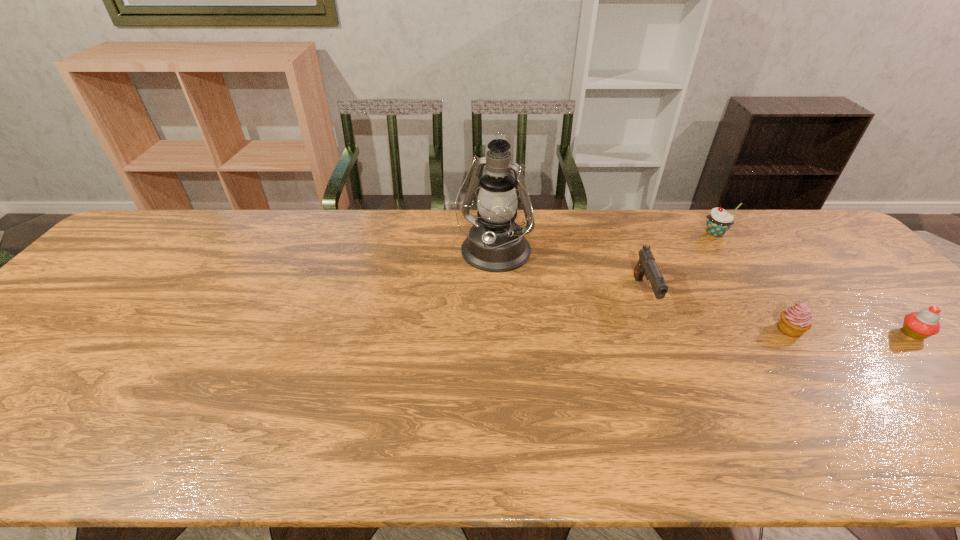
This screenshot has width=960, height=540. I want to click on cupcake at the far edge, so click(x=719, y=221).

At what (x,y) coordinates should I click in order to perform the action: click on object located at the right edge. Please return your answer as a coordinate pair (x, y). Looking at the image, I should click on (920, 325).

The height and width of the screenshot is (540, 960). What are the coordinates of `vacant point at the far edge` in the screenshot? It's located at (584, 221).

This screenshot has height=540, width=960. What are the coordinates of `vacant space at the near edge of the desktop` in the screenshot? It's located at (445, 446).

In the image, there is a desktop. At what (x,y) coordinates should I click in order to perform the action: click on free space at the right edge. Please return your answer as a coordinate pair (x, y). The image size is (960, 540). Looking at the image, I should click on (860, 312).

This screenshot has height=540, width=960. I want to click on vacant region at the far right corner of the desktop, so click(820, 238).

I want to click on free space that is in between the tallest object and the tallest cupcake, so click(x=605, y=244).

You are a GUI agent. You are given a task and a screenshot of the screen. Output one action in this format:
    pyautogui.click(x=<x>, y=<y>)
    Task: Click on the unoccupied position between the rightmost object and the gun
    This screenshot has width=960, height=540.
    Given the screenshot: What is the action you would take?
    pyautogui.click(x=779, y=314)

Identify the location of vacant area that lies between the tallest cupcake and the rightmost cupcake. (814, 284).

The height and width of the screenshot is (540, 960). In order to click on empty space between the rightmost cupcake and the tallest cupcake in this screenshot , I will do point(814,284).